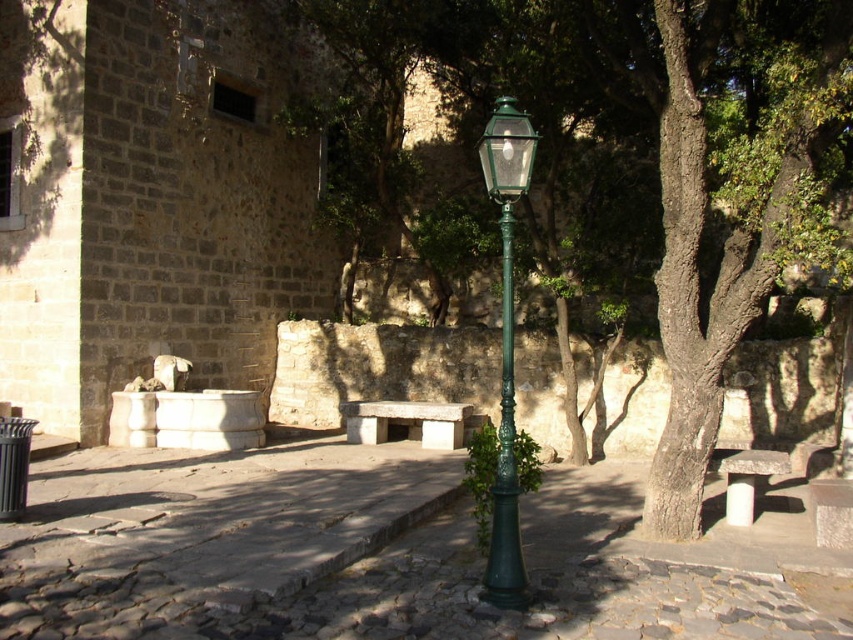
You are a tourist standing in the plaza and want to sit down on the white stone bench at center. You need to walk from the green polished metal street light at center to the bench. Which direction should you move relative to the street light?

You should move to the left relative to the green polished metal street light at center to reach the white stone bench at center, since the street light is to the right of the bench.

You are a city planner assessing the plaza layout. You need to install a new bench that is wider than the existing green polished metal street light at center. Can the white stone bench at center serve as a suitable replacement? Explain why or why not.

The white stone bench at center is wider than the green polished metal street light at center, so it can serve as a suitable replacement because its width meets the requirement of being wider than the existing street light.

You are a tourist standing at the edge of the plaza. You want to sit down on the smooth stone bench at lower right but first need to walk around the green textured tree at center. Since the tree is blocking your path, can you estimate whether you can walk around it without needing to go too far out of your way?

The green textured tree at center is bigger than the smooth stone bench at lower right, but since trees generally have a larger size and spread, you can walk around it by going either left or right of the tree to reach the bench without needing to detour too far.